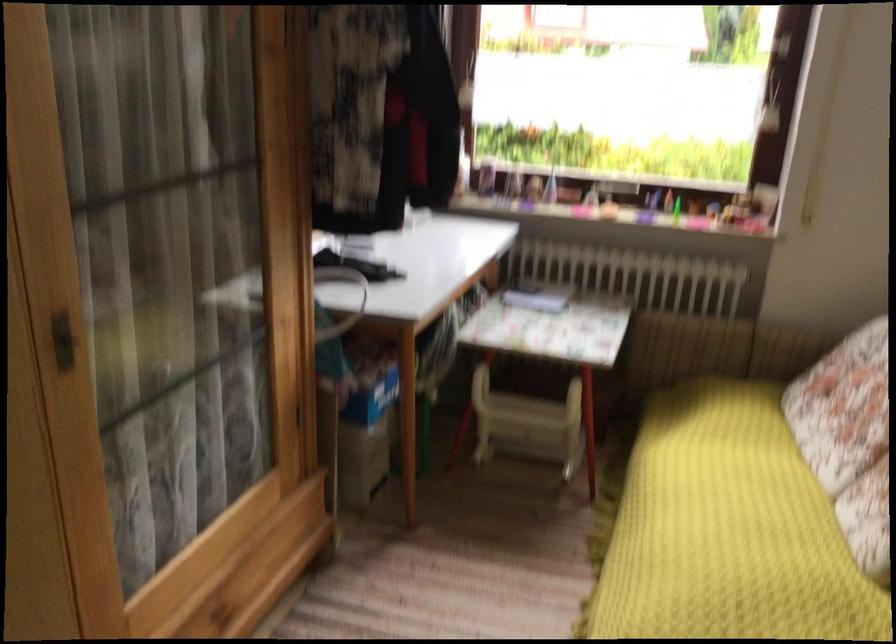
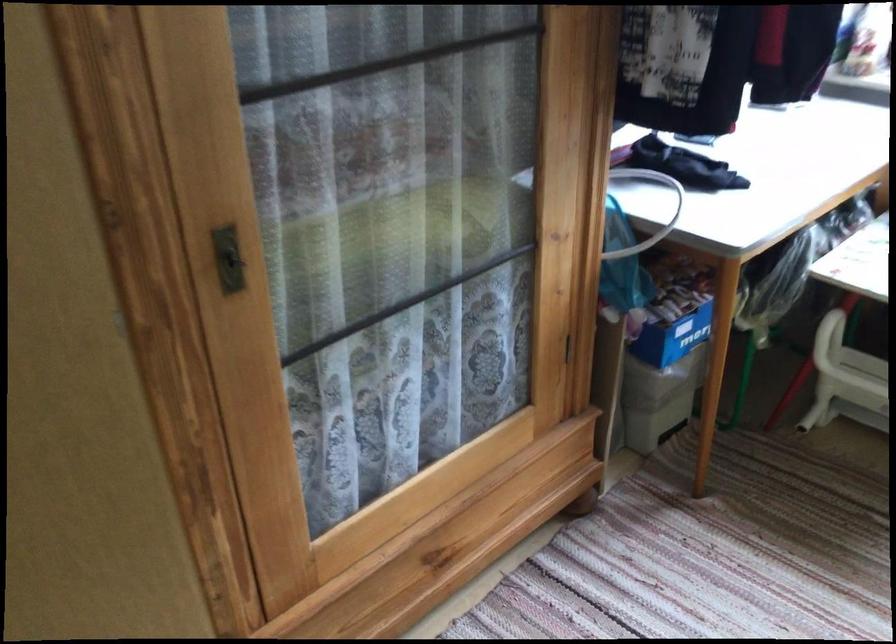
Question: The camera is either moving clockwise (left) or counter-clockwise (right) around the object. The first image is from the beginning of the video and the second image is from the end. Is the camera moving left or right when shooting the video?

Choices:
 (A) Left
 (B) Right

Answer: (B)